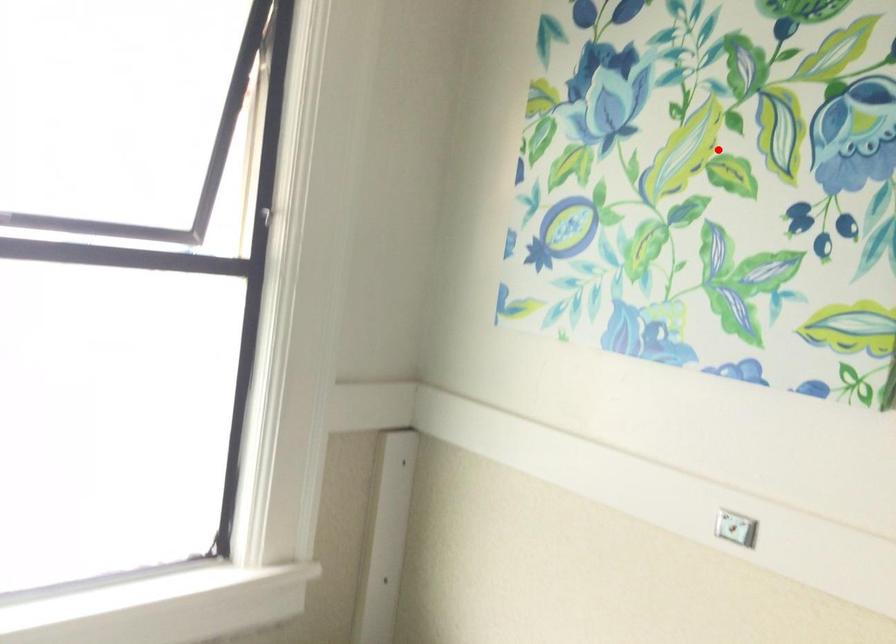
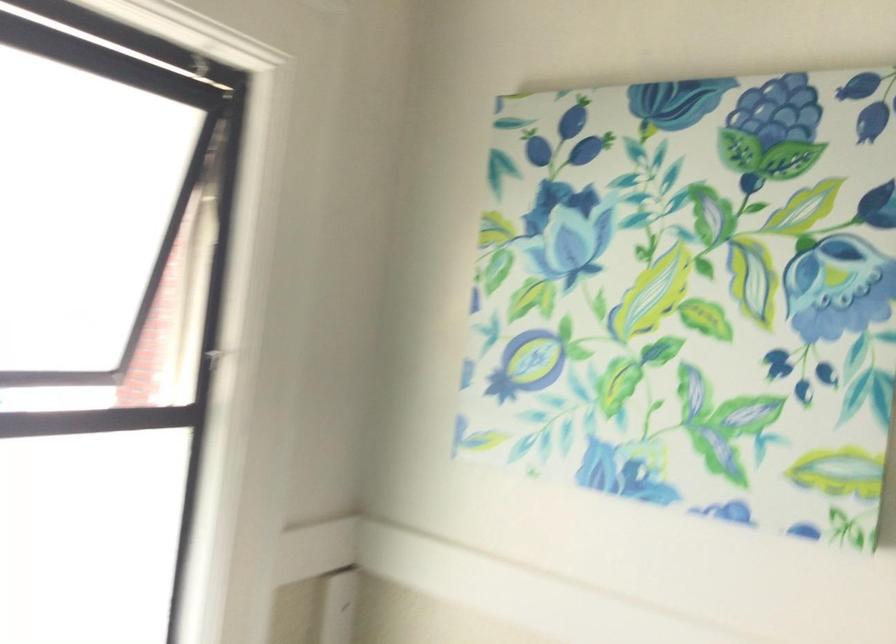
Where in the second image is the point corresponding to the highlighted location from the first image?

(693, 292)